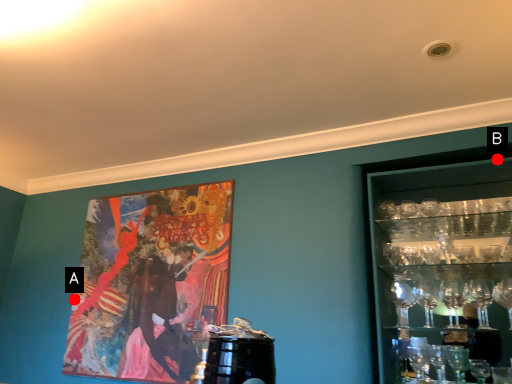
Question: Two points are circled on the image, labeled by A and B beside each circle. Among these points, which one is nearest to the camera?

Choices:
 (A) A is closer
 (B) B is closer

Answer: (B)